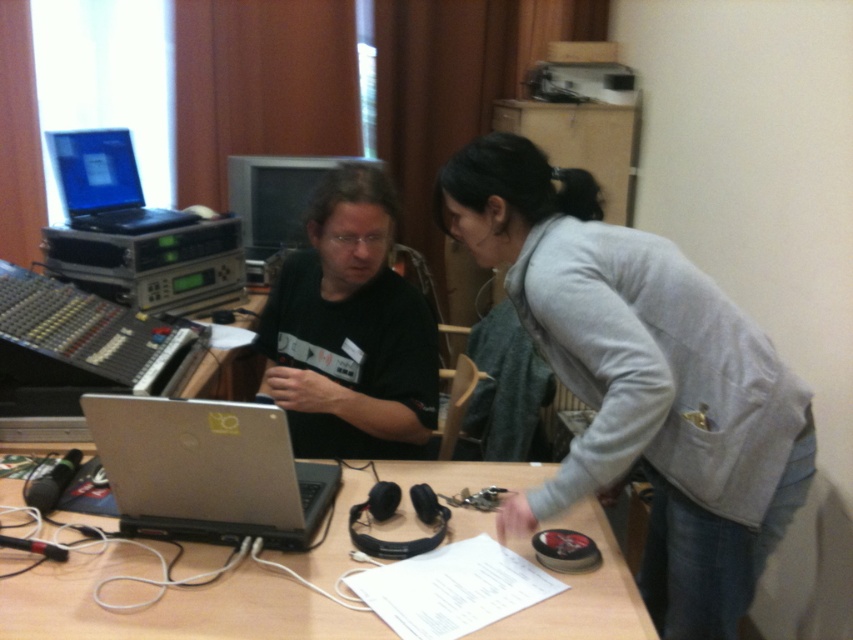
Measure the distance between wooden table at center and silver metallic laptop at center.

A distance of 15.94 centimeters exists between wooden table at center and silver metallic laptop at center.

Between point (331, 532) and point (173, 419), which one is positioned in front?

Point (173, 419)

Is point (248, 632) farther from viewer compared to point (109, 428)?

No, it is not.

I want to click on wooden table at center, so click(173, 604).

Is gray fabric jacket at center to the left of black matte shirt at center from the viewer's perspective?

In fact, gray fabric jacket at center is to the right of black matte shirt at center.

Who is lower down, gray fabric jacket at center or black matte shirt at center?

Positioned lower is gray fabric jacket at center.

What do you see at coordinates (641, 381) in the screenshot? This screenshot has height=640, width=853. I see `gray fabric jacket at center` at bounding box center [641, 381].

Locate an element on the screen. gray fabric jacket at center is located at coordinates (641, 381).

Is gray fabric jacket at center above matte black laptop at upper left?

Actually, gray fabric jacket at center is below matte black laptop at upper left.

Does point (799, 488) come behind point (184, 212)?

That is False.

Find the location of `gray fabric jacket at center`. gray fabric jacket at center is located at coordinates (641, 381).